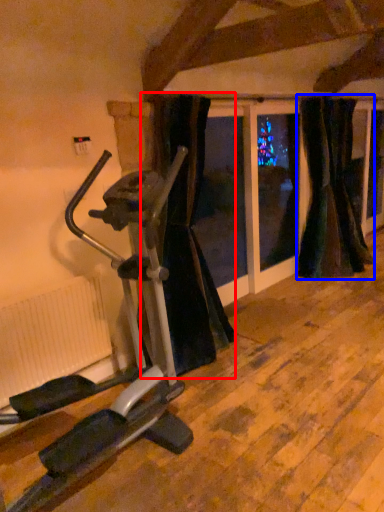
Question: Which of the following is the closest to the observer, curtain (highlighted by a red box) or curtain (highlighted by a blue box)?

Choices:
 (A) curtain
 (B) curtain

Answer: (A)